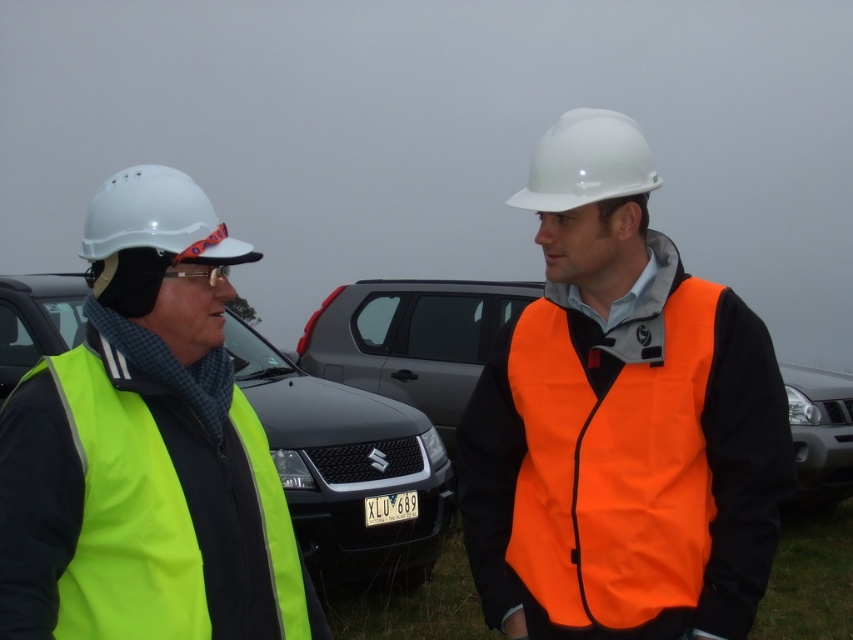
Which of these two, matte orange safety vest at center or neon yellow fabric safety vest at left, stands shorter?

Standing shorter between the two is neon yellow fabric safety vest at left.

Who is higher up, matte orange safety vest at center or neon yellow fabric safety vest at left?

matte orange safety vest at center

Identify the location of matte orange safety vest at center. The image size is (853, 640). (619, 420).

The image size is (853, 640). Describe the element at coordinates (613, 467) in the screenshot. I see `orange fabric safety vest at center` at that location.

Is orange fabric safety vest at center thinner than white hard hat at left?

No.

Who is more forward, (538, 342) or (181, 177)?

Point (181, 177) is in front.

Identify the location of orange fabric safety vest at center. The width and height of the screenshot is (853, 640). (613, 467).

Is point (396, 520) positioned behind point (99, 422)?

Yes.

Is matte black car at left further to the viewer compared to neon yellow fabric safety vest at left?

Yes, matte black car at left is behind neon yellow fabric safety vest at left.

Is point (430, 448) positioned before point (86, 476)?

No.

Where is `matte black car at left`? This screenshot has height=640, width=853. matte black car at left is located at coordinates (347, 467).